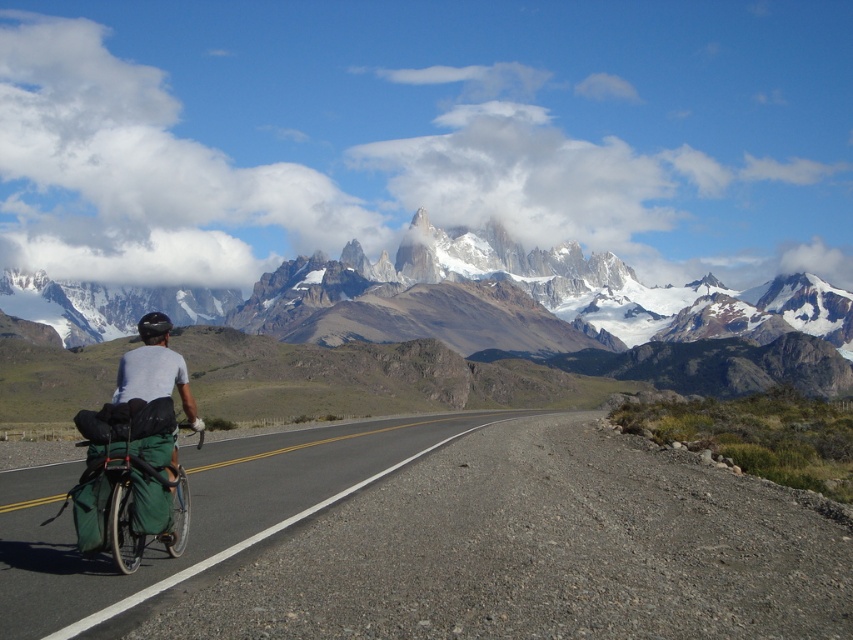
Question: Which point is farther to the camera?

Choices:
 (A) (700, 372)
 (B) (20, 528)

Answer: (A)

Question: From the image, what is the correct spatial relationship of snowy granite mountain range at center in relation to gray fabric helmet at left?

Choices:
 (A) left
 (B) right

Answer: (A)

Question: Does black asphalt road at center appear on the right side of green fabric bag at left?

Choices:
 (A) yes
 (B) no

Answer: (A)

Question: Is snowy granite mountain range at center below gray fabric helmet at left?

Choices:
 (A) no
 (B) yes

Answer: (A)

Question: Which object appears farthest from the camera in this image?

Choices:
 (A) snowy granite mountain range at center
 (B) black asphalt road at center
 (C) gray fabric helmet at left

Answer: (A)

Question: Which point is farther to the camera?

Choices:
 (A) black asphalt road at center
 (B) green fabric bag at left
 (C) gray fabric helmet at left

Answer: (C)